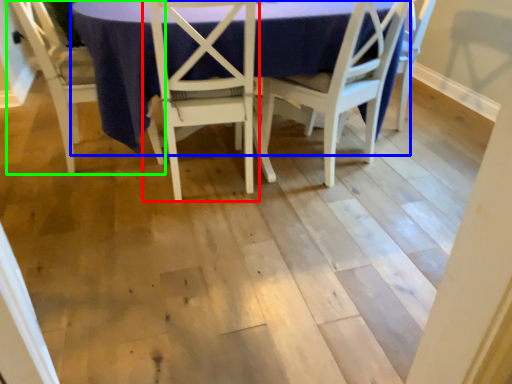
Question: Based on their relative distances, which object is farther from chair (highlighted by a red box)? Choose from round table (highlighted by a blue box) and chair (highlighted by a green box).

Choices:
 (A) round table
 (B) chair

Answer: (B)